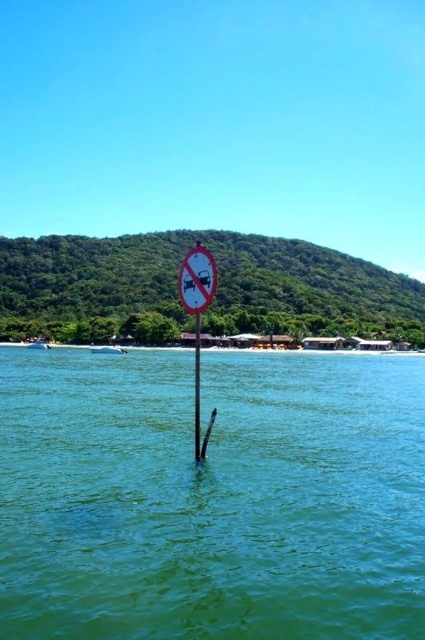
You are standing on the beach and want to cross to the other side of the green water at center and the smooth wood pole at center. Which one would you need to walk around because it is wider?

The green water at center is wider than the smooth wood pole at center, so you would need to walk around the green water at center.

You are a marine biologist studying the coastal area. You observe the green water at center and the smooth wood pole at center in the scene. Which object takes up more area in the image?

The smooth wood pole at center occupies more area than the green water at center, as the green water at center occupies less space than smooth wood pole at center.